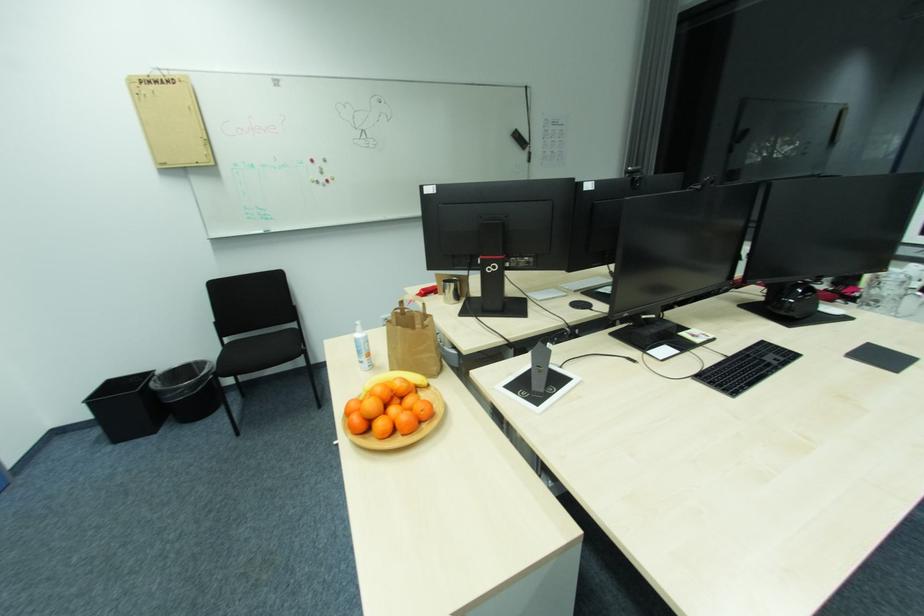
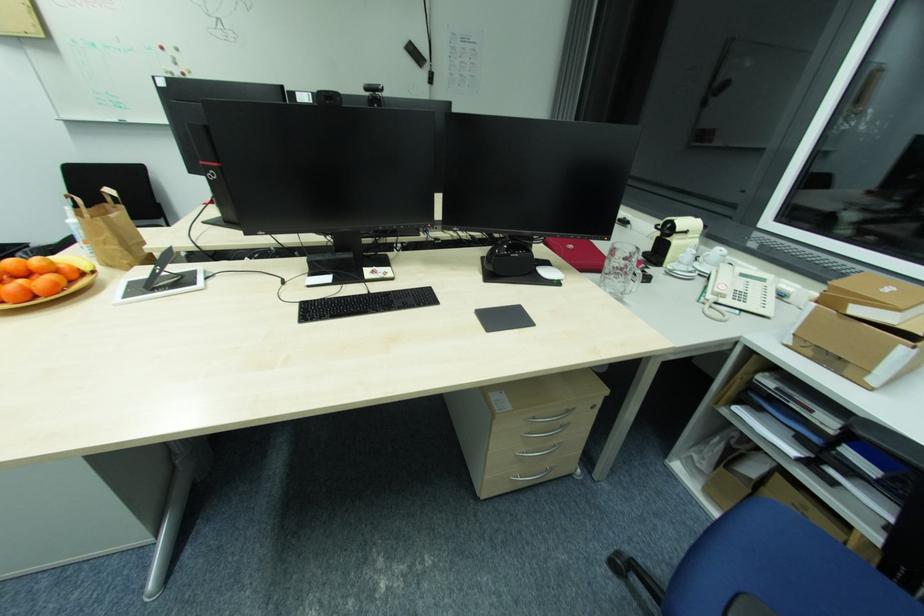
Question: What movement of the cameraman would produce the second image?

Choices:
 (A) Left
 (B) Right
 (C) Forward
 (D) Backward

Answer: (B)